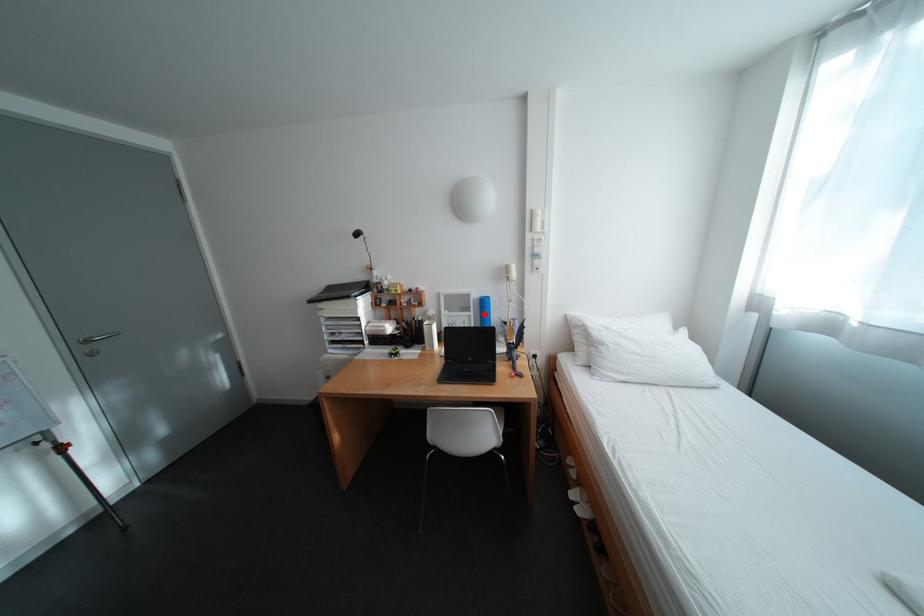
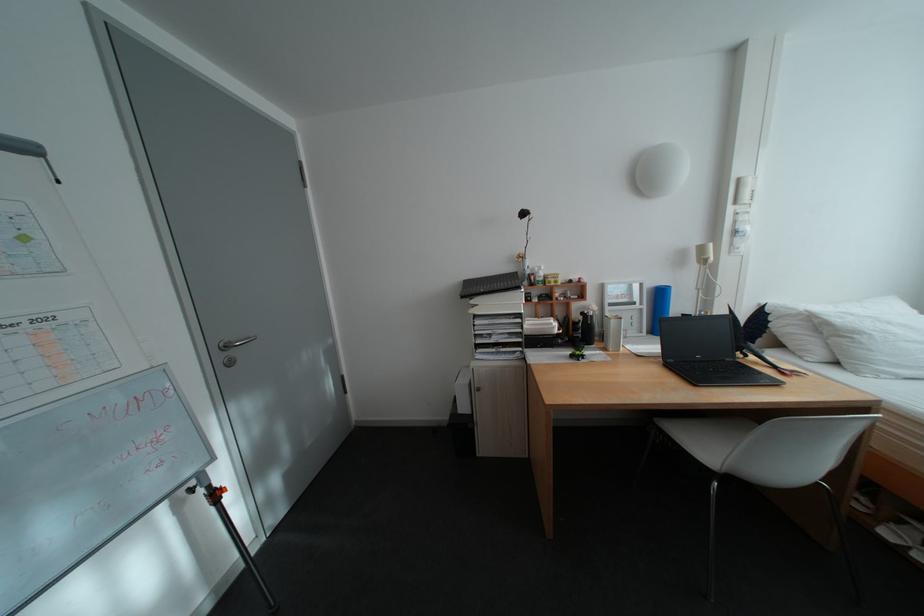
Where in the second image is the point corresponding to the highlighted location from the first image?

(657, 307)